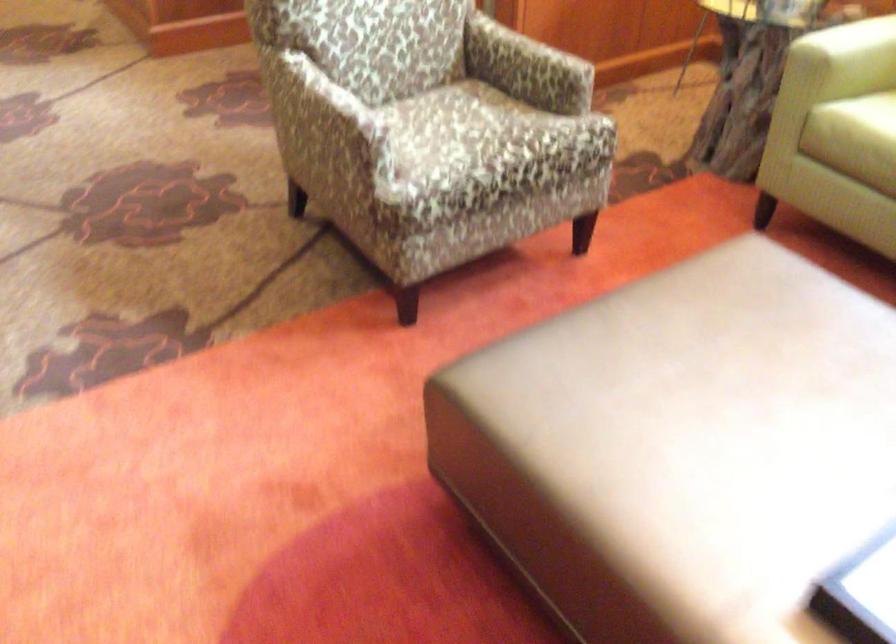
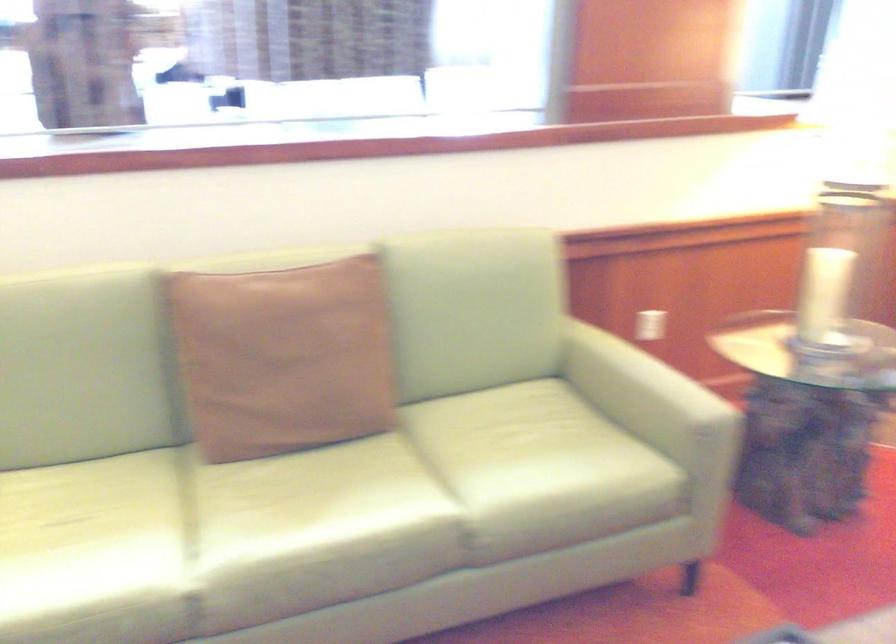
Question: The images are taken continuously from a first-person perspective. In which direction is your viewpoint rotating?

Choices:
 (A) Left
 (B) Right
 (C) Up
 (D) Down

Answer: (B)